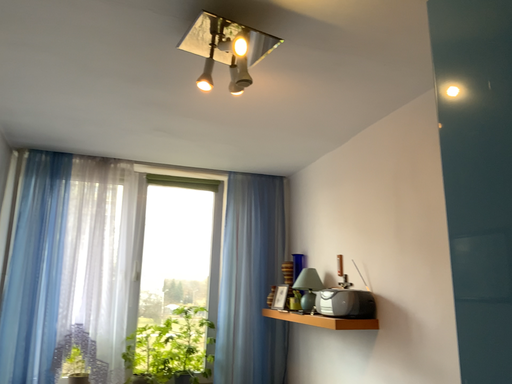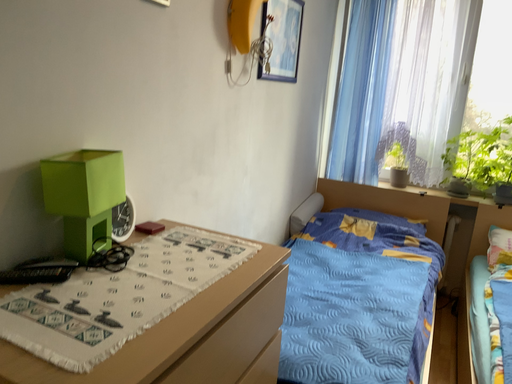
Question: How did the camera likely rotate when shooting the video?

Choices:
 (A) rotated right
 (B) rotated left

Answer: (B)